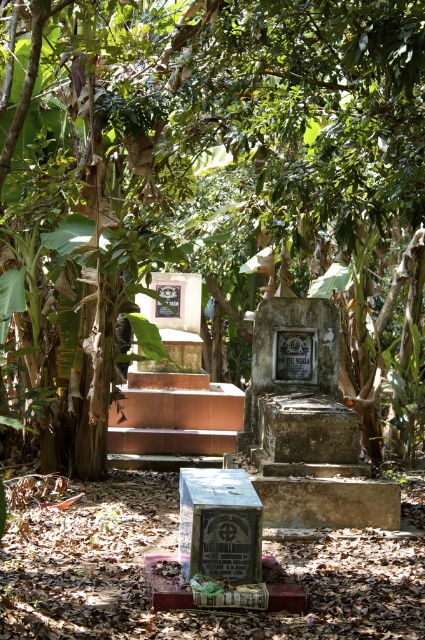
You are a gardener who wants to plant a new tree sapling in this cemetery. You notice the green leafy tree at center and the matte black plaque at center. Which object is taller and would cast a longer shadow during midday?

The green leafy tree at center is taller than the matte black plaque at center, so it would cast a longer shadow during midday.

You are standing at the grave marker with a cross on a red base in the foreground of the cemetery. Looking towards the center of the image, what object is located at the coordinates point (x=201, y=186)?

The point (x=201, y=186) indicates a green leafy tree at center.

You are a maintenance worker in the cemetery and need to access the matte black plaque at center. However, the green leafy tree at center is blocking your path. Can you walk directly to the plaque without moving the tree?

The green leafy tree at center is positioned over matte black plaque at center, so the tree is directly above the plaque. This means you cannot walk directly to the matte black plaque at center without moving the tree as it is obstructed by the tree.